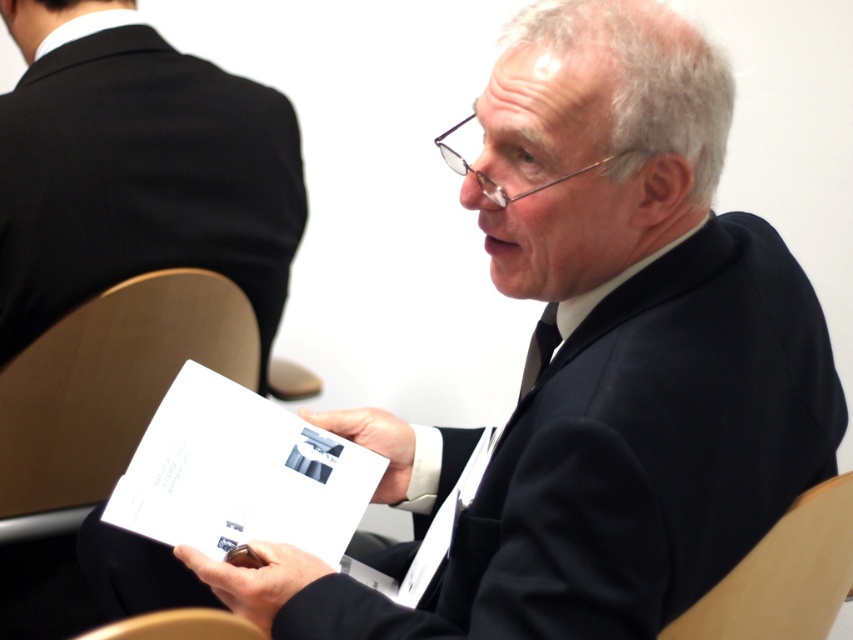
Question: Which is nearer to the white paper at center?

Choices:
 (A) wooden at lower left
 (B) light wood chair at right
 (C) black suit at upper left

Answer: (A)

Question: From the image, what is the correct spatial relationship of white paper at center in relation to light wood chair at right?

Choices:
 (A) above
 (B) below

Answer: (A)

Question: Which point appears closest to the camera in this image?

Choices:
 (A) (814, 563)
 (B) (109, 637)
 (C) (264, 506)

Answer: (B)

Question: Estimate the real-world distances between objects in this image. Which object is farther from the wooden at lower left?

Choices:
 (A) white paper at center
 (B) light wood chair at right
 (C) black suit at upper left

Answer: (C)

Question: Can you confirm if black suit at upper left is positioned below light wood chair at right?

Choices:
 (A) no
 (B) yes

Answer: (A)

Question: Is black suit at upper left positioned before wooden at lower left?

Choices:
 (A) yes
 (B) no

Answer: (B)